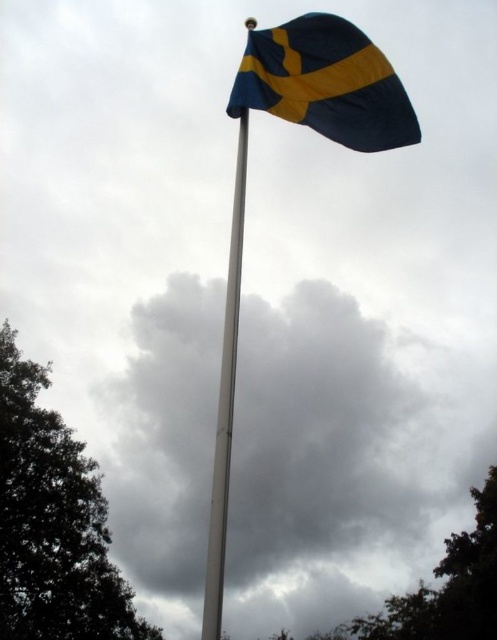
You are standing in front of the Swedish flag attached to the tall white flagpole. You notice a point marked at coordinates (x=341, y=460). Based on the scene description, what does this point most likely represent?

The point at (x=341, y=460) most likely represents the cloudy gray sky at upper center, as indicated by the coordinates provided in the Objects Description.

You are standing in front of the Swedish flag displayed in the scene. A point at coordinate (183, 532) is marked on the flag. If you want to reach that point with a 35 meter long pole, will you be able to? Please explain your reasoning.

The point at coordinate (183, 532) is 40.84 meters away from the camera. Since the pole is only 35 meters long, you won not be able to reach it.